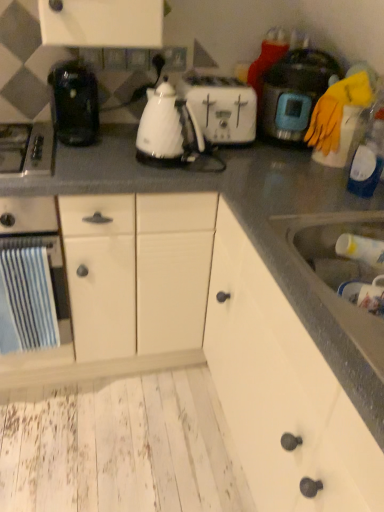
Find the location of a particular element. This screenshot has height=512, width=384. empty space that is ontop of white matte cabinet at center, arranged as the second cabinetry when viewed from the front (from a real-world perspective) is located at coordinates (149, 157).